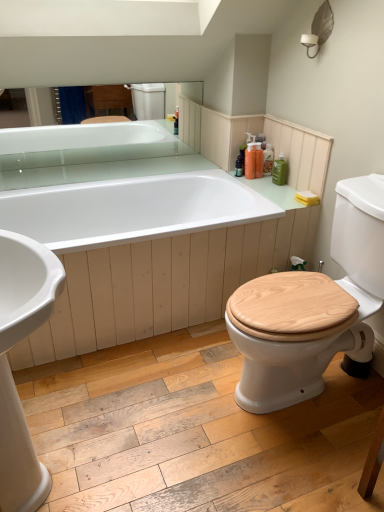
At what (x,y) coordinates should I click in order to perform the action: click on vacant space positioned to the left of yellow sponge at upper right. Please return your answer as a coordinate pair (x, y). Looking at the image, I should click on (293, 198).